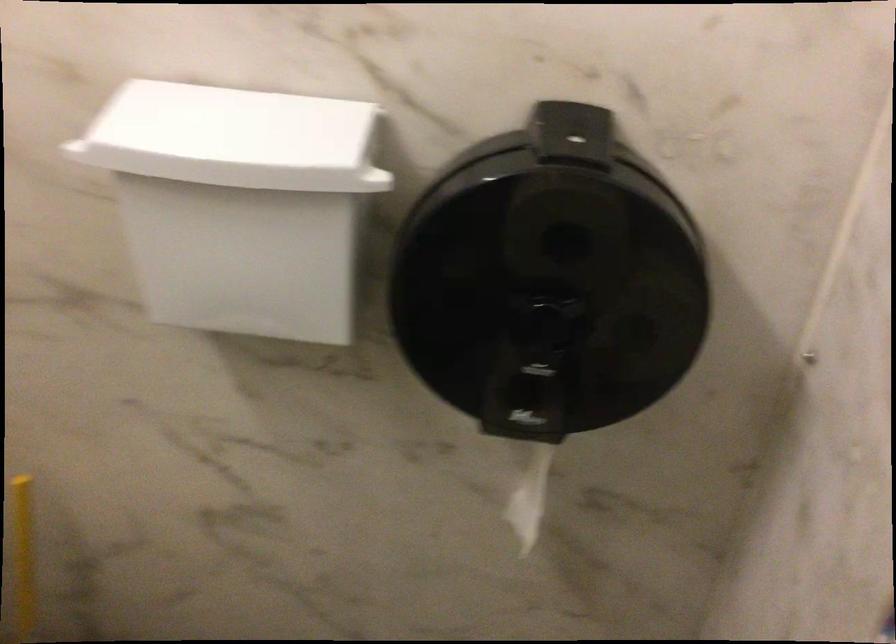
What are the coordinates of `white dispenser lid` in the screenshot? It's located at (234, 138).